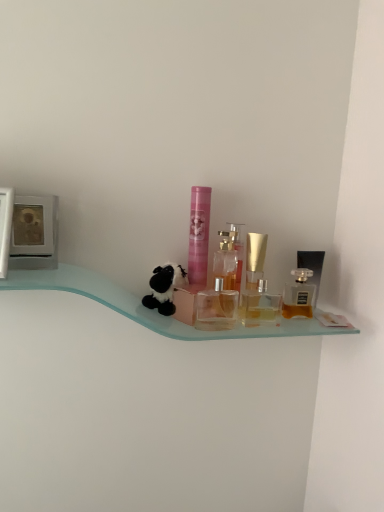
What do you see at coordinates (165, 288) in the screenshot? The height and width of the screenshot is (512, 384). I see `black plush toy at center` at bounding box center [165, 288].

The image size is (384, 512). I want to click on translucent glass perfume bottle at right, marked as the third toiletry in a left-to-right arrangement, so click(312, 267).

This screenshot has width=384, height=512. Describe the element at coordinates (312, 267) in the screenshot. I see `translucent glass perfume bottle at right, marked as the third toiletry in a left-to-right arrangement` at that location.

How much space does translucent glass perfume at center, positioned as the second perfume in left-to-right order, occupy vertically?

translucent glass perfume at center, positioned as the second perfume in left-to-right order, is 7.78 inches tall.

What do you see at coordinates (260, 307) in the screenshot?
I see `transparent plastic perfume bottles at center, which appears as the 2th toiletry when viewed from the right` at bounding box center [260, 307].

Locate an element on the screen. The image size is (384, 512). black plush toy at center is located at coordinates (165, 288).

Is black plush toy at center situated inside translucent glass perfume bottle at right, the first toiletry from the right, or outside?

The correct answer is: outside.

Are black plush toy at center and translucent glass perfume bottle at right, the first toiletry from the right, making contact?

No, black plush toy at center is not with translucent glass perfume bottle at right, the first toiletry from the right.

Which object is thinner, black plush toy at center or translucent glass perfume bottle at right, marked as the third toiletry in a left-to-right arrangement?

Thinner between the two is translucent glass perfume bottle at right, marked as the third toiletry in a left-to-right arrangement.

Locate an element on the screen. Image resolution: width=384 pixels, height=512 pixels. perfume on the left side of transparent plastic perfume bottles at center, which appears as the 2th toiletry when viewed from the right is located at coordinates (237, 250).

From the image's perspective, does clear glass perfume at center, which is counted as the 1th perfume, starting from the left, appear higher than transparent plastic perfume bottles at center, which appears as the 2th toiletry when viewed from the right?

Yes, from the image's perspective, clear glass perfume at center, which is counted as the 1th perfume, starting from the left, is above transparent plastic perfume bottles at center, which appears as the 2th toiletry when viewed from the right.

Is clear glass perfume at center, which is counted as the 1th perfume, starting from the left, positioned with its back to transparent plastic perfume bottles at center, which appears as the 2th toiletry when viewed from the right?

clear glass perfume at center, which is counted as the 1th perfume, starting from the left, does not have its back to transparent plastic perfume bottles at center, which appears as the 2th toiletry when viewed from the right.

Considering the sizes of objects clear glass perfume at center, the third perfume positioned from the right, and transparent plastic perfume bottles at center, which ranks as the second toiletry in left-to-right order, in the image provided, who is bigger, clear glass perfume at center, the third perfume positioned from the right, or transparent plastic perfume bottles at center, which ranks as the second toiletry in left-to-right order,?

transparent plastic perfume bottles at center, which ranks as the second toiletry in left-to-right order.

Can you confirm if transparent plastic perfume bottles at center, which ranks as the second toiletry in left-to-right order, is taller than clear glass perfume at center, the third perfume positioned from the right?

In fact, transparent plastic perfume bottles at center, which ranks as the second toiletry in left-to-right order, may be shorter than clear glass perfume at center, the third perfume positioned from the right.

Can you confirm if transparent plastic perfume bottles at center, which ranks as the second toiletry in left-to-right order, is thinner than clear glass perfume at center, the third perfume positioned from the right?

No, transparent plastic perfume bottles at center, which ranks as the second toiletry in left-to-right order, is not thinner than clear glass perfume at center, the third perfume positioned from the right.

Does point (242, 307) come farther from viewer compared to point (238, 252)?

Yes.

From a real-world perspective, is transparent plastic perfume bottles at center, which ranks as the second toiletry in left-to-right order, on clear glass perfume at center, which is counted as the 1th perfume, starting from the left?

Incorrect, from a real-world perspective, transparent plastic perfume bottles at center, which ranks as the second toiletry in left-to-right order, is lower than clear glass perfume at center, which is counted as the 1th perfume, starting from the left.

Is translucent glass perfume at center, positioned as the second perfume in left-to-right order, positioned beyond the bounds of black plush toy at center?

Absolutely, translucent glass perfume at center, positioned as the second perfume in left-to-right order, is external to black plush toy at center.

Is point (251, 276) less distant than point (175, 286)?

No, it is behind (175, 286).

Is translucent glass perfume at center, the second perfume when ordered from right to left, closer to the viewer compared to black plush toy at center?

No, translucent glass perfume at center, the second perfume when ordered from right to left, is further to the viewer.

Could you tell me if pink matte tube at center, marked as the 3th toiletry in a right-to-left arrangement, is turned towards golden glass perfume at right, placed as the 1th perfume when sorted from right to left?

No, pink matte tube at center, marked as the 3th toiletry in a right-to-left arrangement, is not facing towards golden glass perfume at right, placed as the 1th perfume when sorted from right to left.

Which object is more forward, pink matte tube at center, acting as the 1th toiletry starting from the left, or golden glass perfume at right, placed as the 1th perfume when sorted from right to left?

Positioned in front is pink matte tube at center, acting as the 1th toiletry starting from the left.

Is pink matte tube at center, acting as the 1th toiletry starting from the left, bigger than golden glass perfume at right, the 3th perfume viewed from the left?

Indeed, pink matte tube at center, acting as the 1th toiletry starting from the left, has a larger size compared to golden glass perfume at right, the 3th perfume viewed from the left.

How different are the orientations of pink matte tube at center, acting as the 1th toiletry starting from the left, and golden glass perfume at right, placed as the 1th perfume when sorted from right to left, in degrees?

They differ by 6.59 degrees in their facing directions.

Which of these two, transparent plastic perfume bottles at center, which ranks as the second toiletry in left-to-right order, or translucent glass perfume bottle at right, the first toiletry from the right, is thinner?

Thinner between the two is translucent glass perfume bottle at right, the first toiletry from the right.

How distant is transparent plastic perfume bottles at center, which appears as the 2th toiletry when viewed from the right, from translucent glass perfume bottle at right, the first toiletry from the right?

transparent plastic perfume bottles at center, which appears as the 2th toiletry when viewed from the right, is 13.01 centimeters from translucent glass perfume bottle at right, the first toiletry from the right.

Is point (253, 297) closer to camera compared to point (315, 277)?

No, it is behind (315, 277).

Consider the image. Is transparent plastic perfume bottles at center, which ranks as the second toiletry in left-to-right order, far away from translucent glass perfume bottle at right, marked as the third toiletry in a left-to-right arrangement?

No, transparent plastic perfume bottles at center, which ranks as the second toiletry in left-to-right order, is not far away from translucent glass perfume bottle at right, marked as the third toiletry in a left-to-right arrangement.

Is golden glass perfume at right, the 3th perfume viewed from the left, further to the viewer compared to transparent plastic perfume bottles at center, which ranks as the second toiletry in left-to-right order?

Yes, golden glass perfume at right, the 3th perfume viewed from the left, is behind transparent plastic perfume bottles at center, which ranks as the second toiletry in left-to-right order.

From a real-world perspective, is golden glass perfume at right, placed as the 1th perfume when sorted from right to left, over transparent plastic perfume bottles at center, which appears as the 2th toiletry when viewed from the right?

Yes, from a real-world perspective, golden glass perfume at right, placed as the 1th perfume when sorted from right to left, is on top of transparent plastic perfume bottles at center, which appears as the 2th toiletry when viewed from the right.

In the image, there is a golden glass perfume at right, placed as the 1th perfume when sorted from right to left. Find the location of `toiletry below it (from a real-world perspective)`. toiletry below it (from a real-world perspective) is located at coordinates (260, 307).

Who is shorter, golden glass perfume at right, placed as the 1th perfume when sorted from right to left, or transparent plastic perfume bottles at center, which appears as the 2th toiletry when viewed from the right?

With less height is transparent plastic perfume bottles at center, which appears as the 2th toiletry when viewed from the right.

Where is `toiletry that is the 3rd one when counting rightward from the black plush toy at center`? toiletry that is the 3rd one when counting rightward from the black plush toy at center is located at coordinates (312, 267).

Which toiletry is the 2nd one when counting from the front of the clear glass perfume at center, the third perfume positioned from the right? Please provide its 2D coordinates.

[(260, 307)]

From the image, which object appears to be farther from clear glass perfume at center, the third perfume positioned from the right, transparent plastic perfume bottles at center, which appears as the 2th toiletry when viewed from the right, or translucent glass perfume bottle at right, the first toiletry from the right?

translucent glass perfume bottle at right, the first toiletry from the right, is positioned further to the anchor clear glass perfume at center, the third perfume positioned from the right.

Considering their positions, is golden glass perfume at right, the 3th perfume viewed from the left, positioned further to transparent plastic perfume bottles at center, which ranks as the second toiletry in left-to-right order, than black plush toy at center?

black plush toy at center lies further to transparent plastic perfume bottles at center, which ranks as the second toiletry in left-to-right order, than the other object.

Considering their positions, is transparent plastic perfume bottles at center, which appears as the 2th toiletry when viewed from the right, positioned closer to translucent glass perfume at center, positioned as the second perfume in left-to-right order, than black plush toy at center?

transparent plastic perfume bottles at center, which appears as the 2th toiletry when viewed from the right, is closer to translucent glass perfume at center, positioned as the second perfume in left-to-right order.

From the image, which object appears to be nearer to golden glass perfume at right, placed as the 1th perfume when sorted from right to left, transparent plastic perfume bottles at center, which ranks as the second toiletry in left-to-right order, or pink matte tube at center, acting as the 1th toiletry starting from the left?

The object closer to golden glass perfume at right, placed as the 1th perfume when sorted from right to left, is transparent plastic perfume bottles at center, which ranks as the second toiletry in left-to-right order.

Looking at the image, which one is located further to clear glass perfume at center, which is counted as the 1th perfume, starting from the left, golden glass perfume at right, placed as the 1th perfume when sorted from right to left, or transparent plastic perfume bottles at center, which appears as the 2th toiletry when viewed from the right?

golden glass perfume at right, placed as the 1th perfume when sorted from right to left, is positioned further to the anchor clear glass perfume at center, which is counted as the 1th perfume, starting from the left.

Based on their spatial positions, is translucent glass perfume at center, positioned as the second perfume in left-to-right order, or transparent plastic perfume bottles at center, which appears as the 2th toiletry when viewed from the right, further from golden glass perfume at right, the 3th perfume viewed from the left?

translucent glass perfume at center, positioned as the second perfume in left-to-right order, is positioned further to the anchor golden glass perfume at right, the 3th perfume viewed from the left.

From the image, which object appears to be nearer to golden glass perfume at right, the 3th perfume viewed from the left, pink matte tube at center, acting as the 1th toiletry starting from the left, or translucent glass perfume at center, the second perfume when ordered from right to left?

translucent glass perfume at center, the second perfume when ordered from right to left, is closer to golden glass perfume at right, the 3th perfume viewed from the left.

Estimate the real-world distances between objects in this image. Which object is closer to translucent glass perfume at center, positioned as the second perfume in left-to-right order, golden glass perfume at right, placed as the 1th perfume when sorted from right to left, or transparent plastic perfume bottles at center, which appears as the 2th toiletry when viewed from the right?

transparent plastic perfume bottles at center, which appears as the 2th toiletry when viewed from the right, lies closer to translucent glass perfume at center, positioned as the second perfume in left-to-right order, than the other object.

Where is `perfume between transparent plastic perfume bottles at center, which ranks as the second toiletry in left-to-right order, and golden glass perfume at right, the 3th perfume viewed from the left, from left to right`? The width and height of the screenshot is (384, 512). perfume between transparent plastic perfume bottles at center, which ranks as the second toiletry in left-to-right order, and golden glass perfume at right, the 3th perfume viewed from the left, from left to right is located at coordinates (255, 259).

Identify the location of perfume between pink matte tube at center, marked as the 3th toiletry in a right-to-left arrangement, and translucent glass perfume at center, the second perfume when ordered from right to left, in the horizontal direction. (237, 250).

You are a GUI agent. You are given a task and a screenshot of the screen. Output one action in this format:
    pyautogui.click(x=<x>, y=<y>)
    Task: Click on the perfume between translucent glass perfume at center, the second perfume when ordered from right to left, and translucent glass perfume bottle at right, the first toiletry from the right, in the horizontal direction
    
    Given the screenshot: What is the action you would take?
    pyautogui.click(x=299, y=295)

I want to click on perfume located between black plush toy at center and transparent plastic perfume bottles at center, which appears as the 2th toiletry when viewed from the right, in the left-right direction, so pos(237,250).